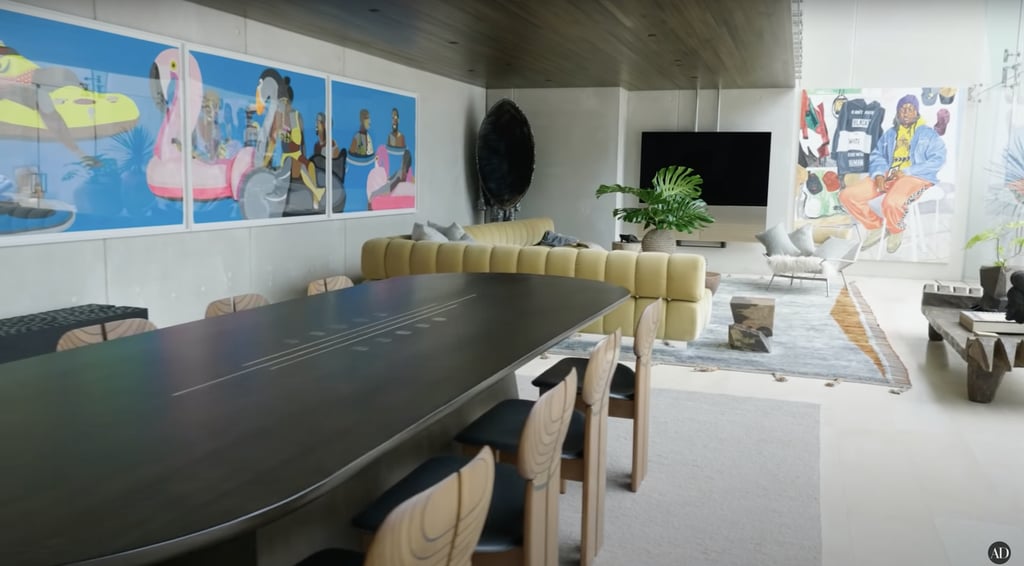
The height and width of the screenshot is (566, 1024). Find the location of `colourful artwork on the wall`. colourful artwork on the wall is located at coordinates (370, 144), (242, 145), (160, 161), (820, 143).